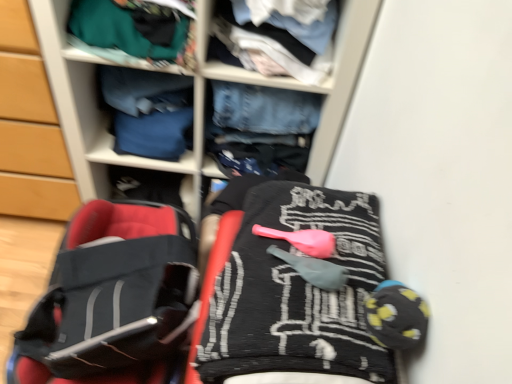
Identify the location of teal fabric at upper left, which ranks as the third clothing in front-to-back order. This screenshot has height=384, width=512. (135, 31).

This screenshot has width=512, height=384. What do you see at coordinates (135, 31) in the screenshot? I see `teal fabric at upper left, the second clothing from the back` at bounding box center [135, 31].

This screenshot has height=384, width=512. Describe the element at coordinates (279, 36) in the screenshot. I see `light blue cotton shirt at upper center, which is counted as the third clothing, starting from the back` at that location.

Measure the distance between black fabric baby carriage at lower left and camera.

black fabric baby carriage at lower left and camera are 34.88 inches apart from each other.

At what (x,y) coordinates should I click in order to perform the action: click on teal fabric at upper left, the second clothing from the back. Please return your answer as a coordinate pair (x, y). Looking at the image, I should click on (135, 31).

Who is more distant, black fabric baby carriage at lower left or denim jeans at center?

→ black fabric baby carriage at lower left is further away from the camera.

Could denim jeans at center be considered to be inside black fabric baby carriage at lower left?

No, denim jeans at center is not surrounded by black fabric baby carriage at lower left.

From a real-world perspective, between black fabric baby carriage at lower left and denim jeans at center, who is vertically higher?

denim jeans at center is physically above.

Does point (189, 278) appear closer or farther from the camera than point (321, 133)?

Point (189, 278) is closer to the camera than point (321, 133).

Can you tell me how much blue denim jeans at center, the fourth clothing from the front, and denim jeans at center differ in facing direction?

There is a 5.65-degree angle between the facing directions of blue denim jeans at center, the fourth clothing from the front, and denim jeans at center.

Is blue denim jeans at center, the fourth clothing from the front, aimed at denim jeans at center?

Yes, blue denim jeans at center, the fourth clothing from the front, is facing denim jeans at center.

From a real-world perspective, does blue denim jeans at center, the fourth clothing from the front, stand above denim jeans at center?

Yes.

You are a GUI agent. You are given a task and a screenshot of the screen. Output one action in this format:
    pyautogui.click(x=<x>, y=<y>)
    Task: Click on the 2nd clothing behind the wooden cabinet at left
    The height and width of the screenshot is (384, 512).
    Given the screenshot: What is the action you would take?
    coord(148,111)

How different are the orientations of blue denim jeans at center, acting as the first clothing starting from the back, and wooden cabinet at left in degrees?

blue denim jeans at center, acting as the first clothing starting from the back, and wooden cabinet at left are facing 5.65 degrees away from each other.

Looking at this image, from the image's perspective, between blue denim jeans at center, the fourth clothing from the front, and wooden cabinet at left, who is located below?

blue denim jeans at center, the fourth clothing from the front.

Can you confirm if blue denim jeans at center, the fourth clothing from the front, is positioned to the left of wooden cabinet at left?

Incorrect, blue denim jeans at center, the fourth clothing from the front, is not on the left side of wooden cabinet at left.

From the image's perspective, is blue denim jeans at center, the fourth clothing from the front, over light blue cotton shirt at upper center, which is counted as the third clothing, starting from the back?

No, from the image's perspective, blue denim jeans at center, the fourth clothing from the front, is not on top of light blue cotton shirt at upper center, which is counted as the third clothing, starting from the back.

In the scene shown: From a real-world perspective, who is located lower, blue denim jeans at center, the fourth clothing from the front, or light blue cotton shirt at upper center, which is counted as the third clothing, starting from the back?

blue denim jeans at center, the fourth clothing from the front.

Can you confirm if blue denim jeans at center, the fourth clothing from the front, is positioned to the left of light blue cotton shirt at upper center, which is counted as the third clothing, starting from the back?

Indeed, blue denim jeans at center, the fourth clothing from the front, is positioned on the left side of light blue cotton shirt at upper center, which is counted as the third clothing, starting from the back.

Is blue denim jeans at center, the fourth clothing from the front, looking in the opposite direction of light blue cotton shirt at upper center, which is the second clothing in front-to-back order?

No, blue denim jeans at center, the fourth clothing from the front,'s orientation is not away from light blue cotton shirt at upper center, which is the second clothing in front-to-back order.

Which is in front, black textured blanket at center, which is the 1th clothing in front-to-back order, or wooden cabinet at left?

Positioned in front is black textured blanket at center, which is the 1th clothing in front-to-back order.

Between black textured blanket at center, which is the 1th clothing in front-to-back order, and wooden cabinet at left, which one appears on the right side from the viewer's perspective?

black textured blanket at center, which is the 1th clothing in front-to-back order.

Consider the image. Is black textured blanket at center, which is the 1th clothing in front-to-back order, situated inside wooden cabinet at left or outside?

black textured blanket at center, which is the 1th clothing in front-to-back order, lies outside wooden cabinet at left.

Is wooden cabinet at left at the back of black textured blanket at center, which is the 1th clothing in front-to-back order?

No, black textured blanket at center, which is the 1th clothing in front-to-back order,'s orientation is not away from wooden cabinet at left.

Is black fabric baby carriage at lower left far from blue denim jeans at center, the fourth clothing from the front?

Actually, black fabric baby carriage at lower left and blue denim jeans at center, the fourth clothing from the front, are a little close together.

Based on the photo, considering the relative sizes of black fabric baby carriage at lower left and blue denim jeans at center, the fourth clothing from the front, in the image provided, is black fabric baby carriage at lower left smaller than blue denim jeans at center, the fourth clothing from the front,?

No, black fabric baby carriage at lower left is not smaller than blue denim jeans at center, the fourth clothing from the front.

Is blue denim jeans at center, the fourth clothing from the front, a part of black fabric baby carriage at lower left?

No, blue denim jeans at center, the fourth clothing from the front, is not inside black fabric baby carriage at lower left.

Looking at their sizes, would you say black fabric baby carriage at lower left is wider or thinner than blue denim jeans at center, acting as the first clothing starting from the back?

Clearly, black fabric baby carriage at lower left has more width compared to blue denim jeans at center, acting as the first clothing starting from the back.

Who is smaller, denim jeans at center or light blue cotton shirt at upper center, which is counted as the third clothing, starting from the back?

With smaller size is light blue cotton shirt at upper center, which is counted as the third clothing, starting from the back.

Does denim jeans at center lie behind light blue cotton shirt at upper center, which is the second clothing in front-to-back order?

No, it is not.

Is point (64, 107) closer to viewer compared to point (257, 16)?

No, (64, 107) is further to viewer.

In the image, there is a denim jeans at center. Where is `baby carriage below it (from the image's perspective)`? This screenshot has width=512, height=384. baby carriage below it (from the image's perspective) is located at coordinates (112, 298).

From the denim jeans at center, count the 2nd clothing to the left and point to it. Please provide its 2D coordinates.

[(148, 111)]

Which object lies nearer to the anchor point light blue cotton shirt at upper center, which is counted as the third clothing, starting from the back, black textured blanket at center, the fourth clothing in the back-to-front sequence, or denim jeans at center?

Based on the image, denim jeans at center appears to be nearer to light blue cotton shirt at upper center, which is counted as the third clothing, starting from the back.

Which object lies further to the anchor point wooden cabinet at left, light blue cotton shirt at upper center, which is the second clothing in front-to-back order, or blue denim jeans at center, the fourth clothing from the front?

Based on the image, light blue cotton shirt at upper center, which is the second clothing in front-to-back order, appears to be further to wooden cabinet at left.

Based on their spatial positions, is blue denim jeans at center, the fourth clothing from the front, or denim jeans at center closer to light blue cotton shirt at upper center, which is counted as the third clothing, starting from the back?

denim jeans at center lies closer to light blue cotton shirt at upper center, which is counted as the third clothing, starting from the back, than the other object.

When comparing their distances from black fabric baby carriage at lower left, does wooden cabinet at left or light blue cotton shirt at upper center, which is counted as the third clothing, starting from the back, seem closer?

wooden cabinet at left is closer to black fabric baby carriage at lower left.

In the scene shown: Considering their positions, is denim jeans at center positioned closer to light blue cotton shirt at upper center, which is the second clothing in front-to-back order, than blue denim jeans at center, the fourth clothing from the front?

denim jeans at center is closer to light blue cotton shirt at upper center, which is the second clothing in front-to-back order.

Looking at the image, which one is located further to wooden cabinet at left, blue denim jeans at center, the fourth clothing from the front, or teal fabric at upper left, which ranks as the third clothing in front-to-back order?

teal fabric at upper left, which ranks as the third clothing in front-to-back order, is positioned further to the anchor wooden cabinet at left.

In the scene shown: From the image, which object appears to be farther from blue denim jeans at center, the fourth clothing from the front, teal fabric at upper left, the second clothing from the back, or light blue cotton shirt at upper center, which is the second clothing in front-to-back order?

light blue cotton shirt at upper center, which is the second clothing in front-to-back order, lies further to blue denim jeans at center, the fourth clothing from the front, than the other object.

From the image, which object appears to be farther from black fabric baby carriage at lower left, teal fabric at upper left, which ranks as the third clothing in front-to-back order, or blue denim jeans at center, the fourth clothing from the front?

teal fabric at upper left, which ranks as the third clothing in front-to-back order, is further to black fabric baby carriage at lower left.

Locate an element on the screen. This screenshot has width=512, height=384. clothing situated between blue denim jeans at center, the fourth clothing from the front, and light blue cotton shirt at upper center, which is the second clothing in front-to-back order, from left to right is located at coordinates (135, 31).

Locate an element on the screen. The height and width of the screenshot is (384, 512). baby carriage between black textured blanket at center, the fourth clothing in the back-to-front sequence, and blue denim jeans at center, acting as the first clothing starting from the back, in the front-back direction is located at coordinates (112, 298).

This screenshot has height=384, width=512. I want to click on shelf between black textured blanket at center, the fourth clothing in the back-to-front sequence, and blue denim jeans at center, the fourth clothing from the front, from front to back, so pos(194,99).

The image size is (512, 384). I want to click on cabinetry that lies between teal fabric at upper left, the second clothing from the back, and black fabric baby carriage at lower left from top to bottom, so click(x=30, y=126).